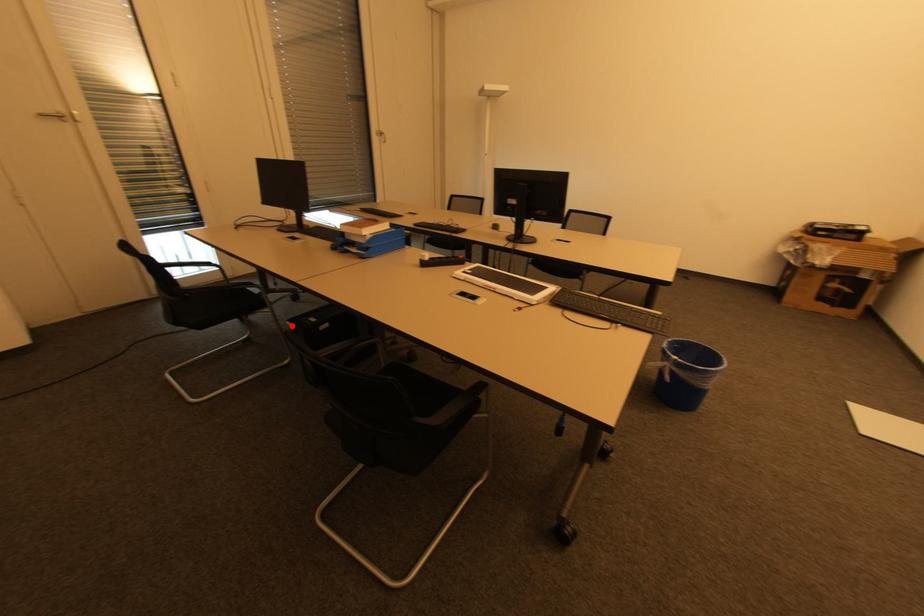
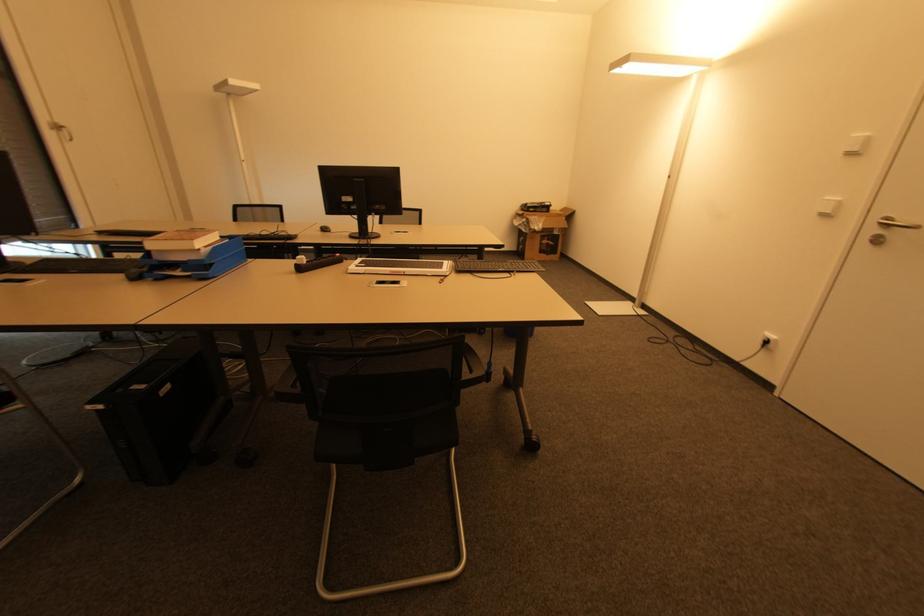
Question: I am providing you with two images of the same scene from different viewpoints. A red point is marked on the first image. At the location where the point appears in image 1, is it still visible in image 2?

Choices:
 (A) Yes
 (B) No

Answer: (A)